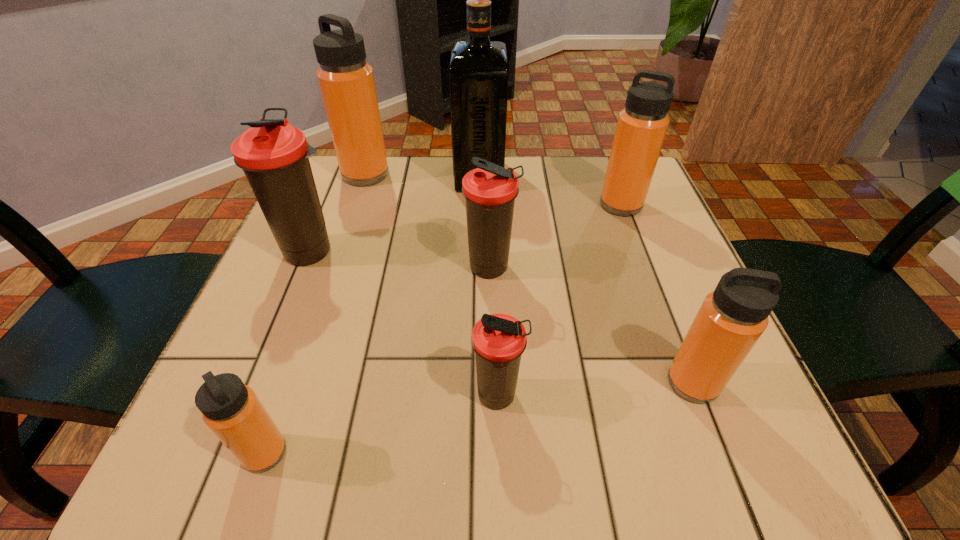
Locate an element on the screen. This screenshot has height=540, width=960. object that is at the far left corner is located at coordinates (346, 81).

The image size is (960, 540). Identify the location of object situated at the near left corner. (232, 410).

Find the location of `object located in the far right corner section of the desktop`. object located in the far right corner section of the desktop is located at coordinates (641, 127).

This screenshot has width=960, height=540. I want to click on free space at the far edge of the desktop, so click(403, 195).

Where is `vacant space at the left edge of the desktop`? This screenshot has width=960, height=540. vacant space at the left edge of the desktop is located at coordinates (252, 376).

This screenshot has width=960, height=540. Identify the location of free space at the right edge of the desktop. (636, 353).

Find the location of a particular element. The height and width of the screenshot is (540, 960). vacant space at the far left corner of the desktop is located at coordinates coord(347,191).

Where is `vacant space at the near left corner of the desktop`? Image resolution: width=960 pixels, height=540 pixels. vacant space at the near left corner of the desktop is located at coordinates (196, 461).

Locate an element on the screen. The width and height of the screenshot is (960, 540). free space at the far right corner is located at coordinates (582, 160).

Find the location of a particular element. Image resolution: width=960 pixels, height=540 pixels. free space at the near right corner of the desktop is located at coordinates (696, 447).